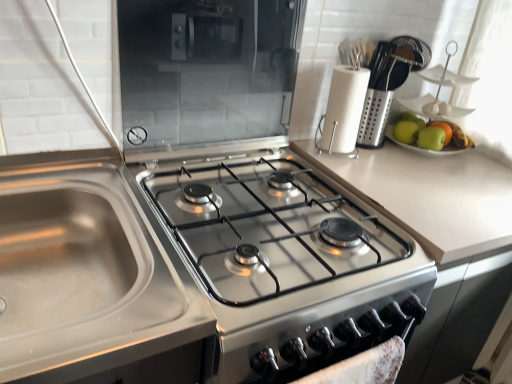
Find the location of a particular element. The width and height of the screenshot is (512, 384). vacant space positioned to the left of green matte apple at upper right, which ranks as the third apple in right-to-left order is located at coordinates point(373,145).